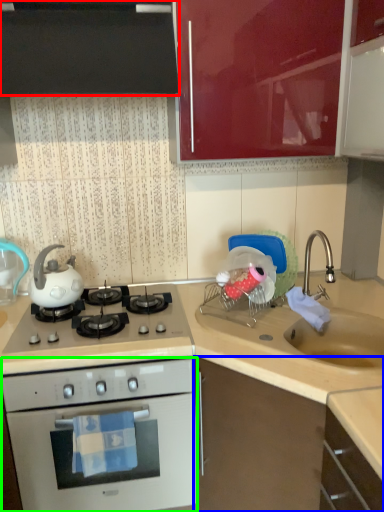
Question: Considering the real-world distances, which object is farthest from cabinetry (highlighted by a red box)? cabinetry (highlighted by a blue box) or oven (highlighted by a green box)?

Choices:
 (A) cabinetry
 (B) oven

Answer: (A)